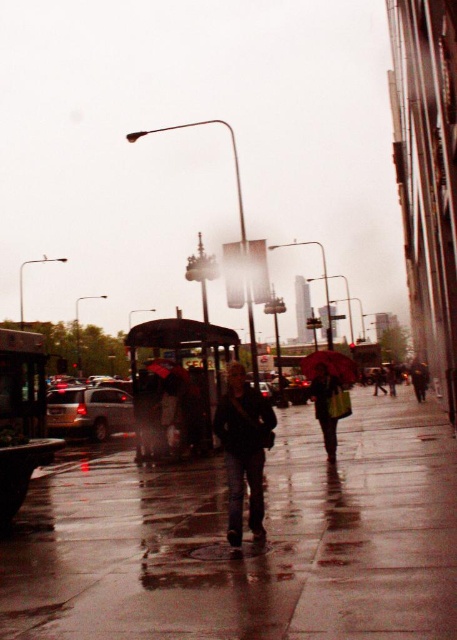
Question: Considering the relative positions of wet asphalt sidewalk at center and raincoat matte at center in the image provided, where is wet asphalt sidewalk at center located with respect to raincoat matte at center?

Choices:
 (A) left
 (B) right

Answer: (A)

Question: Which is farther from the raincoat matte at center?

Choices:
 (A) black plastic bus stop at center
 (B) dark red fabric umbrella at center

Answer: (A)

Question: Is dark blue leather jacket at center bigger than raincoat fabric umbrella at center?

Choices:
 (A) yes
 (B) no

Answer: (B)

Question: Which object is farther from the camera taking this photo?

Choices:
 (A) raincoat matte at center
 (B) black plastic bus stop at center
 (C) dark blue leather jacket at center

Answer: (B)

Question: Which object is closer to the camera taking this photo?

Choices:
 (A) dark red fabric umbrella at center
 (B) raincoat fabric umbrella at center
 (C) wet asphalt sidewalk at center
 (D) black plastic bus stop at center

Answer: (C)

Question: Can you confirm if matte black suv at lower left is thinner than raincoat fabric umbrella at center?

Choices:
 (A) no
 (B) yes

Answer: (A)